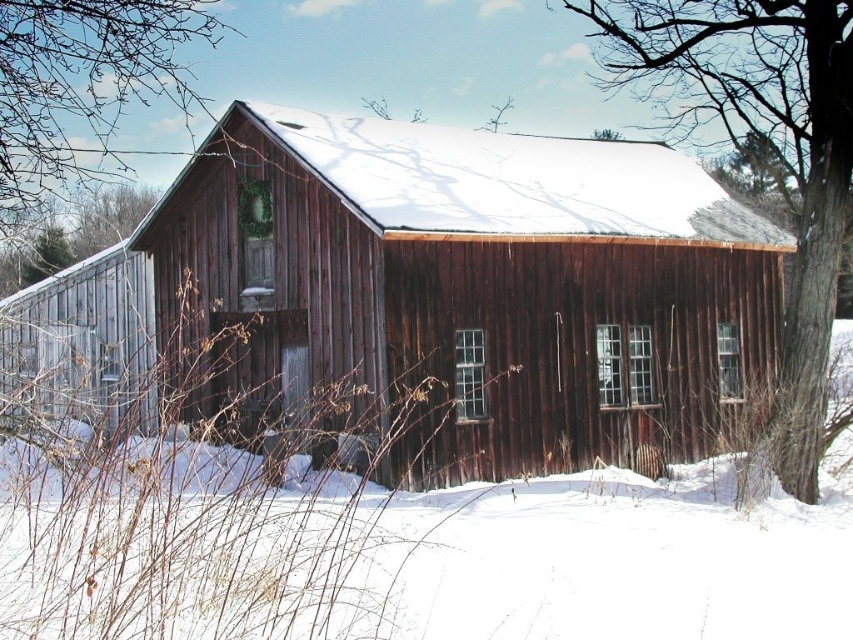
Is rustic wood cabin at center to the right of smooth bark tree at right from the viewer's perspective?

Incorrect, rustic wood cabin at center is not on the right side of smooth bark tree at right.

This screenshot has width=853, height=640. Find the location of `rustic wood cabin at center`. rustic wood cabin at center is located at coordinates (485, 280).

Between point (720, 262) and point (822, 390), which one is positioned in front?

Point (822, 390)

Find the location of a particular element. rustic wood cabin at center is located at coordinates (485, 280).

Does point (701, 353) lie in front of point (10, 120)?

No, it is behind (10, 120).

The image size is (853, 640). I want to click on rustic wood cabin at center, so click(x=485, y=280).

The image size is (853, 640). I want to click on rustic wood cabin at center, so click(485, 280).

The width and height of the screenshot is (853, 640). What do you see at coordinates (769, 150) in the screenshot?
I see `smooth bark tree at right` at bounding box center [769, 150].

Between point (819, 259) and point (6, 227), which one is positioned in front?

Point (819, 259)

Identify the location of smooth bark tree at right. (769, 150).